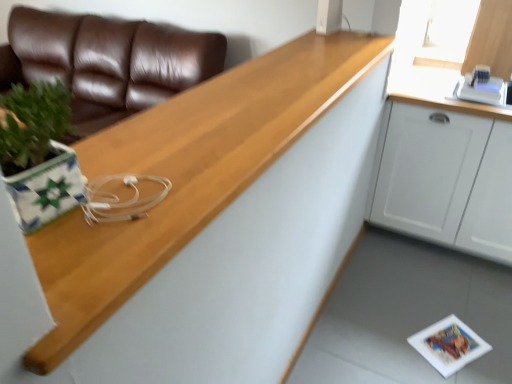
Question: Does wooden at left have a larger size compared to white matte cabinet at upper right?

Choices:
 (A) no
 (B) yes

Answer: (A)

Question: From a real-world perspective, does wooden at left sit lower than white matte cabinet at upper right?

Choices:
 (A) no
 (B) yes

Answer: (A)

Question: Can you confirm if wooden at left is wider than white matte cabinet at upper right?

Choices:
 (A) yes
 (B) no

Answer: (B)

Question: From a real-world perspective, is wooden at left on top of white matte cabinet at upper right?

Choices:
 (A) yes
 (B) no

Answer: (A)

Question: From the image's perspective, is wooden at left beneath white matte cabinet at upper right?

Choices:
 (A) no
 (B) yes

Answer: (A)

Question: Which is correct: white matte cabinet at upper right is inside brown leather couch at upper left, or outside of it?

Choices:
 (A) outside
 (B) inside

Answer: (A)

Question: Is white matte cabinet at upper right taller or shorter than brown leather couch at upper left?

Choices:
 (A) tall
 (B) short

Answer: (B)

Question: Looking at their shapes, would you say white matte cabinet at upper right is wider or thinner than brown leather couch at upper left?

Choices:
 (A) wide
 (B) thin

Answer: (B)

Question: Considering the positions of point (500, 144) and point (20, 52), is point (500, 144) closer or farther from the camera than point (20, 52)?

Choices:
 (A) closer
 (B) farther

Answer: (A)

Question: Considering their positions, is wooden at left located in front of or behind brown leather couch at upper left?

Choices:
 (A) behind
 (B) front

Answer: (B)

Question: Which is correct: wooden at left is inside brown leather couch at upper left, or outside of it?

Choices:
 (A) outside
 (B) inside

Answer: (A)

Question: Does point (46, 347) appear closer or farther from the camera than point (104, 56)?

Choices:
 (A) farther
 (B) closer

Answer: (B)

Question: From a real-world perspective, is wooden at left positioned above or below brown leather couch at upper left?

Choices:
 (A) below
 (B) above

Answer: (B)

Question: Looking at their shapes, would you say wooden at left is wider or thinner than white matte cabinet at upper right?

Choices:
 (A) wide
 (B) thin

Answer: (B)

Question: In terms of height, does wooden at left look taller or shorter compared to white matte cabinet at upper right?

Choices:
 (A) tall
 (B) short

Answer: (B)